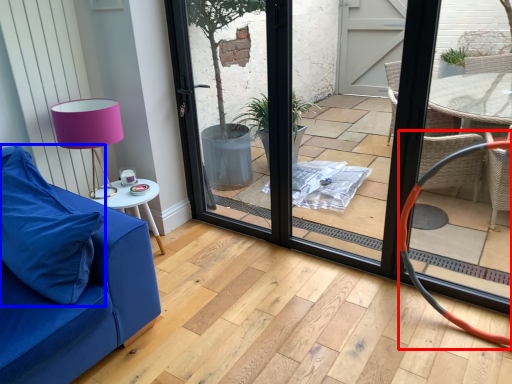
Question: Which object is further to the camera taking this photo, armchair (highlighted by a red box) or pillow (highlighted by a blue box)?

Choices:
 (A) armchair
 (B) pillow

Answer: (A)